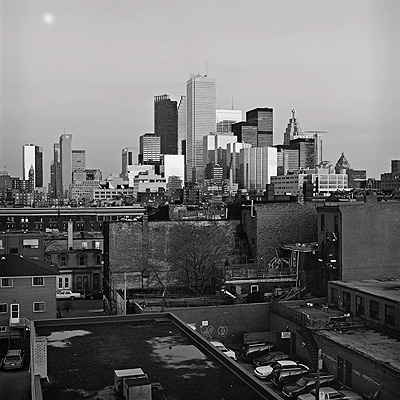
Where is `chimneys`? This screenshot has width=400, height=400. chimneys is located at coordinates (124, 372), (133, 383).